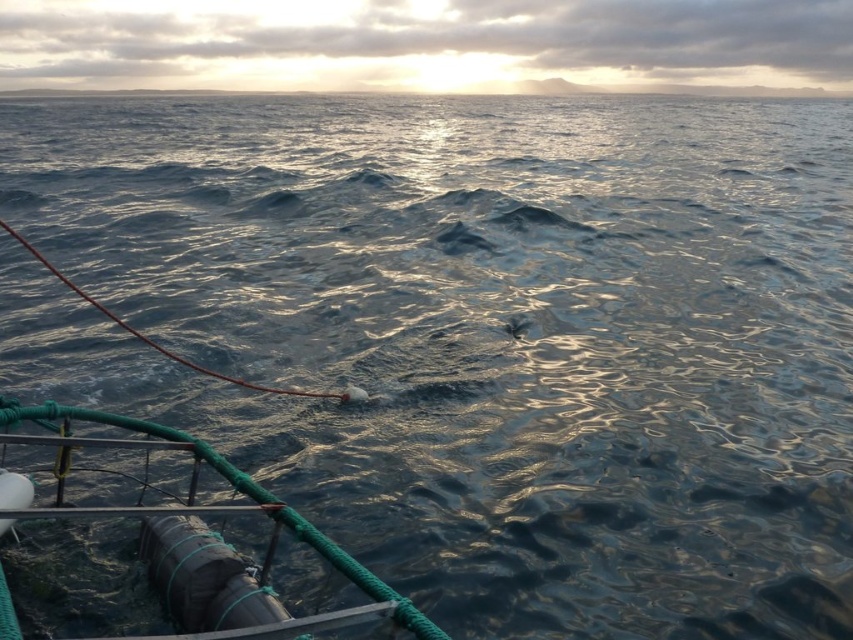
Which is more to the left, rubberized black cylinder at lower left or smooth sky at upper center?

rubberized black cylinder at lower left is more to the left.

Which of these two, rubberized black cylinder at lower left or smooth sky at upper center, stands shorter?

rubberized black cylinder at lower left

Which is behind, point (161, 509) or point (660, 93)?

Point (660, 93)

This screenshot has width=853, height=640. Find the location of `rubberized black cylinder at lower left`. rubberized black cylinder at lower left is located at coordinates (122, 448).